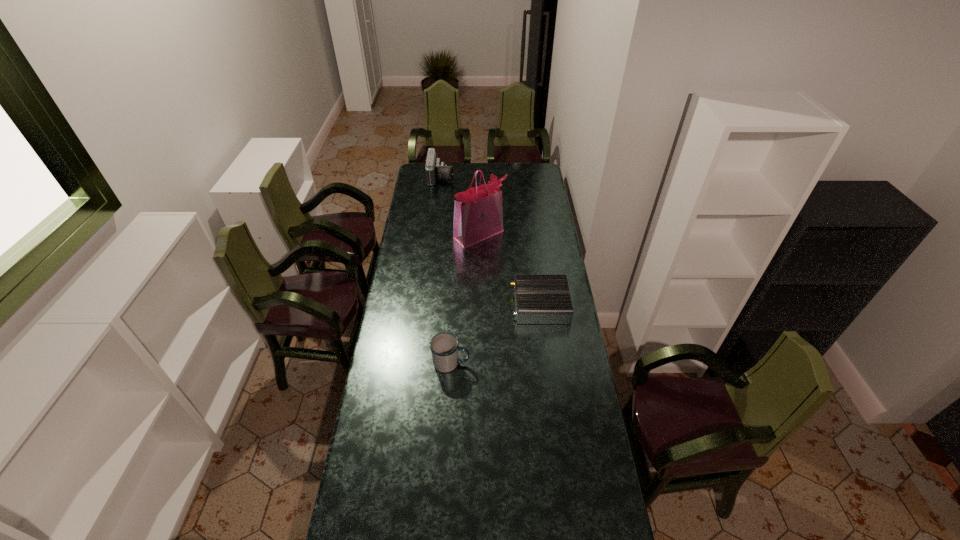
Find the location of a particular element. This screenshot has width=960, height=540. shopping bag is located at coordinates (478, 212).

The image size is (960, 540). Find the location of `the third nearest object`. the third nearest object is located at coordinates (478, 212).

The image size is (960, 540). I want to click on camera, so click(x=435, y=170).

I want to click on the second shortest object, so click(444, 347).

The height and width of the screenshot is (540, 960). Identify the location of the nearest object. (444, 347).

In order to click on the shortest object in this screenshot , I will do pyautogui.click(x=539, y=299).

At what (x,y) coordinates should I click in order to perform the action: click on the rightmost object. Please return your answer as a coordinate pair (x, y). The width and height of the screenshot is (960, 540). Looking at the image, I should click on (539, 299).

Where is `vacant space located 0.260m on the right of the tallest object`? Image resolution: width=960 pixels, height=540 pixels. vacant space located 0.260m on the right of the tallest object is located at coordinates (553, 234).

What are the coordinates of `free region located at the front of the camera with an open lens cover` in the screenshot? It's located at (492, 177).

Where is `vacant region located 0.290m on the handle side of the nearest object`? This screenshot has width=960, height=540. vacant region located 0.290m on the handle side of the nearest object is located at coordinates tap(541, 363).